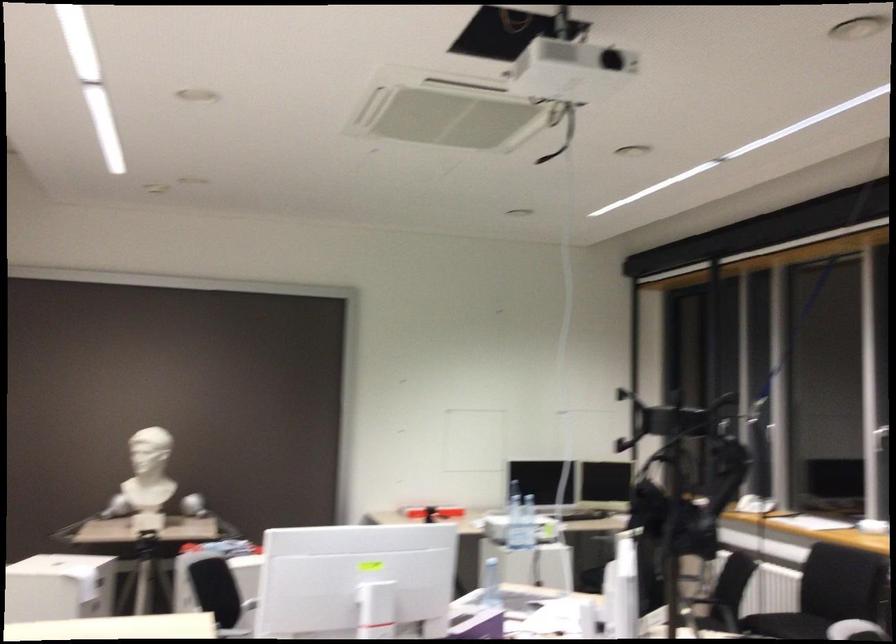
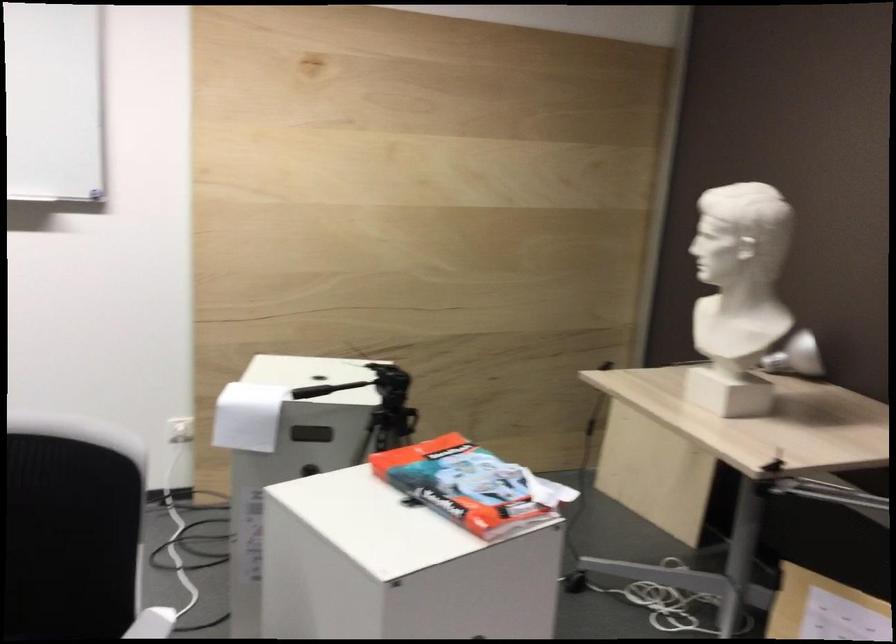
The point at [97,567] is marked in the first image. Where is the corresponding point in the second image?

(247, 415)